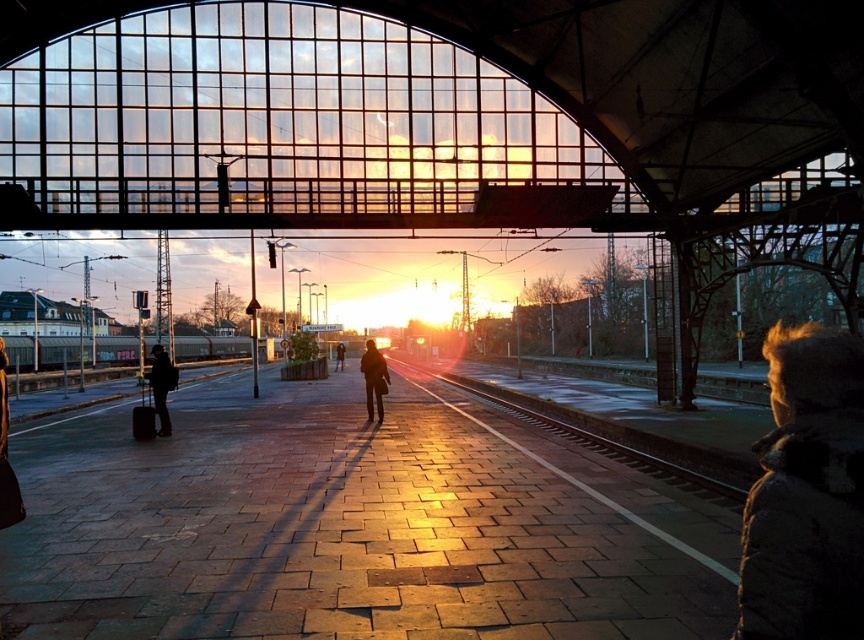
Where is `metallic smooth train track at center`? The image size is (864, 640). metallic smooth train track at center is located at coordinates (604, 440).

Between metallic smooth train track at center and dark brown leather jacket at center, which one has more height?

dark brown leather jacket at center is taller.

Image resolution: width=864 pixels, height=640 pixels. Describe the element at coordinates (604, 440) in the screenshot. I see `metallic smooth train track at center` at that location.

Locate an element on the screen. The width and height of the screenshot is (864, 640). metallic smooth train track at center is located at coordinates (604, 440).

Is dark fuzzy jacket at lower right below dark brown leather jacket at center?

Actually, dark fuzzy jacket at lower right is above dark brown leather jacket at center.

In the scene shown: Who is higher up, dark fuzzy jacket at lower right or dark brown leather jacket at center?

dark fuzzy jacket at lower right is above.

Where is `dark fuzzy jacket at lower right`? dark fuzzy jacket at lower right is located at coordinates (805, 493).

Is dark brown leather coat at center above dark brown leather jacket at center?

Yes.

Can you confirm if dark brown leather coat at center is bigger than dark brown leather jacket at center?

Actually, dark brown leather coat at center might be smaller than dark brown leather jacket at center.

This screenshot has height=640, width=864. Describe the element at coordinates (373, 378) in the screenshot. I see `dark brown leather coat at center` at that location.

Find the location of a particular element. dark brown leather coat at center is located at coordinates (373, 378).